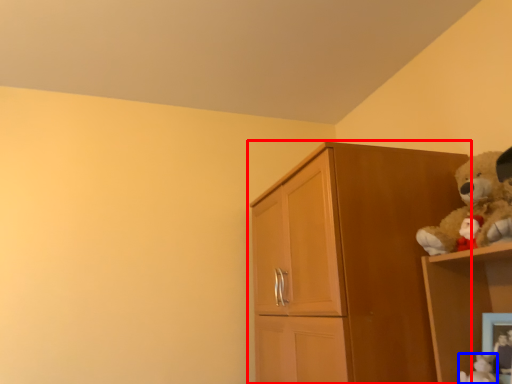
Question: Which object appears closest to the camera in this image, cupboard (highlighted by a red box) or toy (highlighted by a blue box)?

Choices:
 (A) cupboard
 (B) toy

Answer: (A)